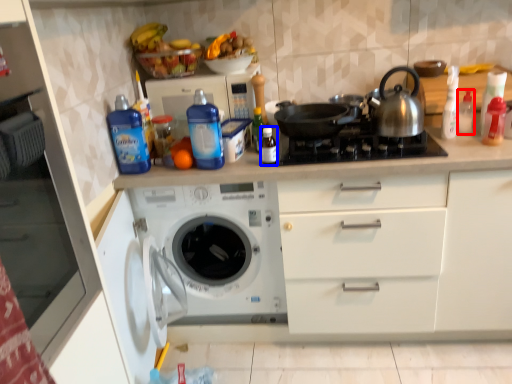
Question: Which object is further to the camera taking this photo, bottle (highlighted by a red box) or bottle (highlighted by a blue box)?

Choices:
 (A) bottle
 (B) bottle

Answer: (A)